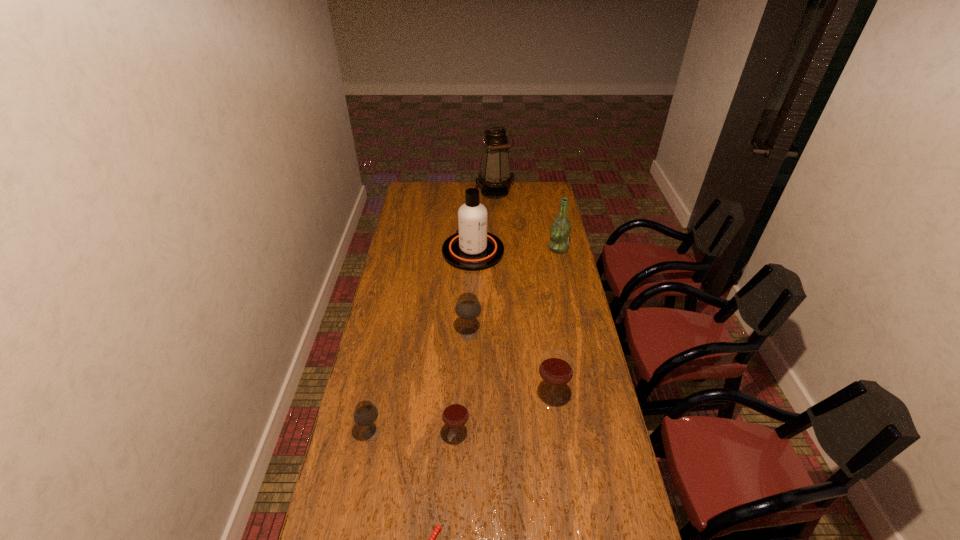
Find the location of a particular element. brown oil lamp is located at coordinates (495, 175).

The image size is (960, 540). What are the coordinates of `oil lamp` in the screenshot? It's located at (495, 175).

The image size is (960, 540). What are the coordinates of `the seventh shortest object` in the screenshot? It's located at (473, 248).

The image size is (960, 540). What are the coordinates of `cleansing agent` in the screenshot? It's located at (473, 248).

This screenshot has height=540, width=960. What are the coordinates of `the rightmost object` in the screenshot? It's located at coord(560,230).

Where is `beer bottle`? This screenshot has height=540, width=960. beer bottle is located at coordinates (560, 230).

This screenshot has height=540, width=960. What are the coordinates of `the farther red wineglass` in the screenshot? It's located at (556, 367).

Where is `the rightmost wineglass`? This screenshot has width=960, height=540. the rightmost wineglass is located at coordinates (556, 367).

The image size is (960, 540). Identify the location of the farther gray wineglass. (468, 307).

The width and height of the screenshot is (960, 540). What are the coordinates of `the bigger gray wineglass` in the screenshot? It's located at (468, 307).